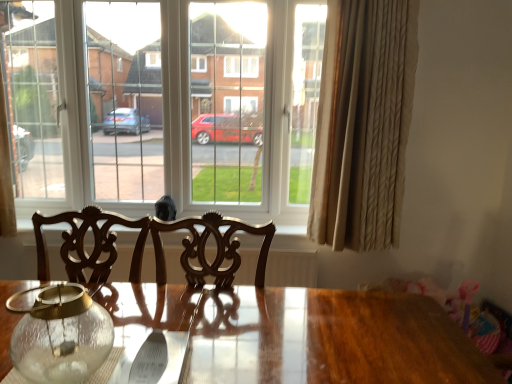
Question: From the image's perspective, is clear glass window at center beneath transparent glass jar at lower left?

Choices:
 (A) no
 (B) yes

Answer: (A)

Question: From a real-world perspective, is clear glass window at center located higher than transparent glass jar at lower left?

Choices:
 (A) yes
 (B) no

Answer: (A)

Question: Can you see clear glass window at center touching transparent glass jar at lower left?

Choices:
 (A) no
 (B) yes

Answer: (A)

Question: Considering the relative sizes of clear glass window at center and transparent glass jar at lower left in the image provided, is clear glass window at center bigger than transparent glass jar at lower left?

Choices:
 (A) no
 (B) yes

Answer: (B)

Question: Can you confirm if clear glass window at center is wider than transparent glass jar at lower left?

Choices:
 (A) yes
 (B) no

Answer: (A)

Question: Is clear glass window at center not inside transparent glass jar at lower left?

Choices:
 (A) yes
 (B) no

Answer: (A)

Question: Is clear glass window at center oriented towards beige textured curtain at right?

Choices:
 (A) no
 (B) yes

Answer: (A)

Question: Considering the relative sizes of clear glass window at center and beige textured curtain at right in the image provided, is clear glass window at center wider than beige textured curtain at right?

Choices:
 (A) no
 (B) yes

Answer: (B)

Question: Does clear glass window at center have a lesser height compared to beige textured curtain at right?

Choices:
 (A) yes
 (B) no

Answer: (A)

Question: Does clear glass window at center have a greater height compared to beige textured curtain at right?

Choices:
 (A) no
 (B) yes

Answer: (A)

Question: Is clear glass window at center smaller than beige textured curtain at right?

Choices:
 (A) yes
 (B) no

Answer: (B)

Question: Is there a large distance between clear glass window at center and beige textured curtain at right?

Choices:
 (A) no
 (B) yes

Answer: (A)

Question: From the image's perspective, is transparent glass jar at lower left located above clear glass window at center?

Choices:
 (A) no
 (B) yes

Answer: (A)